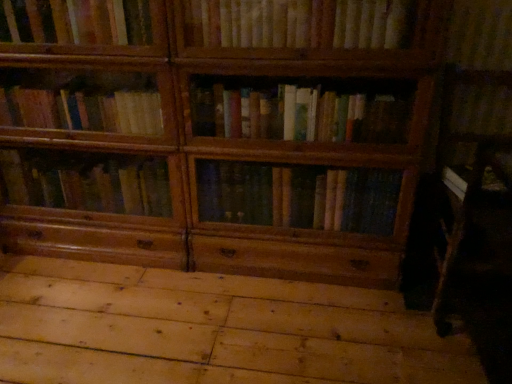
Find the location of a particular element. The image size is (512, 384). wooden bookshelf at upper center is located at coordinates (265, 23).

This screenshot has width=512, height=384. Describe the element at coordinates (265, 23) in the screenshot. I see `wooden bookshelf at upper center` at that location.

Where is `natural wood floor at lower center`? The width and height of the screenshot is (512, 384). natural wood floor at lower center is located at coordinates (212, 330).

Describe the element at coordinates (212, 330) in the screenshot. The height and width of the screenshot is (384, 512). I see `natural wood floor at lower center` at that location.

The width and height of the screenshot is (512, 384). Find the location of `wooden bookshelf at upper center`. wooden bookshelf at upper center is located at coordinates (265, 23).

Between natural wood floor at lower center and wooden bookshelf at upper center, which one appears on the right side from the viewer's perspective?

Positioned to the right is wooden bookshelf at upper center.

Based on the photo, is the depth of natural wood floor at lower center less than that of wooden bookshelf at upper center?

Yes.

Is point (18, 332) positioned before point (35, 39)?

No.

Consider the image. From the image's perspective, relative to wooden bookshelf at upper center, is natural wood floor at lower center above or below?

natural wood floor at lower center is situated lower than wooden bookshelf at upper center in the image.

From a real-world perspective, is natural wood floor at lower center located higher than wooden bookshelf at upper center?

Incorrect, from a real-world perspective, natural wood floor at lower center is lower than wooden bookshelf at upper center.

Considering the relative sizes of natural wood floor at lower center and wooden bookshelf at upper center in the image provided, is natural wood floor at lower center wider than wooden bookshelf at upper center?

Yes, natural wood floor at lower center is wider than wooden bookshelf at upper center.

Who is taller, natural wood floor at lower center or wooden bookshelf at upper center?

wooden bookshelf at upper center.

Considering the sizes of objects natural wood floor at lower center and wooden bookshelf at upper center in the image provided, who is smaller, natural wood floor at lower center or wooden bookshelf at upper center?

With smaller size is wooden bookshelf at upper center.

Choose the correct answer: Is natural wood floor at lower center inside wooden bookshelf at upper center or outside it?

natural wood floor at lower center is spatially situated outside wooden bookshelf at upper center.

Is natural wood floor at lower center placed right next to wooden bookshelf at upper center?

natural wood floor at lower center is not next to wooden bookshelf at upper center, and they're not touching.

Is natural wood floor at lower center aimed at wooden bookshelf at upper center?

No, natural wood floor at lower center is not facing towards wooden bookshelf at upper center.

The width and height of the screenshot is (512, 384). I want to click on plywood that appears below the wooden bookshelf at upper center (from a real-world perspective), so click(212, 330).

Considering the positions of objects wooden bookshelf at upper center and natural wood floor at lower center in the image provided, who is more to the right, wooden bookshelf at upper center or natural wood floor at lower center?

Positioned to the right is wooden bookshelf at upper center.

Which object is closer to the camera, wooden bookshelf at upper center or natural wood floor at lower center?

natural wood floor at lower center.

Which is in front, point (10, 19) or point (321, 310)?

The point (10, 19) is in front.

From the image's perspective, between wooden bookshelf at upper center and natural wood floor at lower center, who is located below?

natural wood floor at lower center appears lower in the image.

From a real-world perspective, who is located higher, wooden bookshelf at upper center or natural wood floor at lower center?

wooden bookshelf at upper center, from a real-world perspective.

Based on the photo, is wooden bookshelf at upper center wider than natural wood floor at lower center?

Incorrect, the width of wooden bookshelf at upper center does not surpass that of natural wood floor at lower center.

Is wooden bookshelf at upper center taller than natural wood floor at lower center?

Indeed, wooden bookshelf at upper center has a greater height compared to natural wood floor at lower center.

Looking at the image, does wooden bookshelf at upper center seem bigger or smaller compared to natural wood floor at lower center?

Clearly, wooden bookshelf at upper center is smaller in size than natural wood floor at lower center.

Is wooden bookshelf at upper center surrounding natural wood floor at lower center?

Actually, natural wood floor at lower center is outside wooden bookshelf at upper center.

Is wooden bookshelf at upper center beside natural wood floor at lower center?

No, wooden bookshelf at upper center is not touching natural wood floor at lower center.

Is wooden bookshelf at upper center looking in the opposite direction of natural wood floor at lower center?

wooden bookshelf at upper center is not turned away from natural wood floor at lower center.

How much distance is there between wooden bookshelf at upper center and natural wood floor at lower center?

They are 3.35 feet apart.

Where is `book lying on the right of natural wood floor at lower center`? book lying on the right of natural wood floor at lower center is located at coordinates (265, 23).

You are a GUI agent. You are given a task and a screenshot of the screen. Output one action in this format:
    pyautogui.click(x=<x>, y=<y>)
    Task: Click on the plywood in front of the wooden bookshelf at upper center
    The height and width of the screenshot is (384, 512).
    Given the screenshot: What is the action you would take?
    pyautogui.click(x=212, y=330)

Locate an element on the screen. The height and width of the screenshot is (384, 512). book located behind the natural wood floor at lower center is located at coordinates (265, 23).